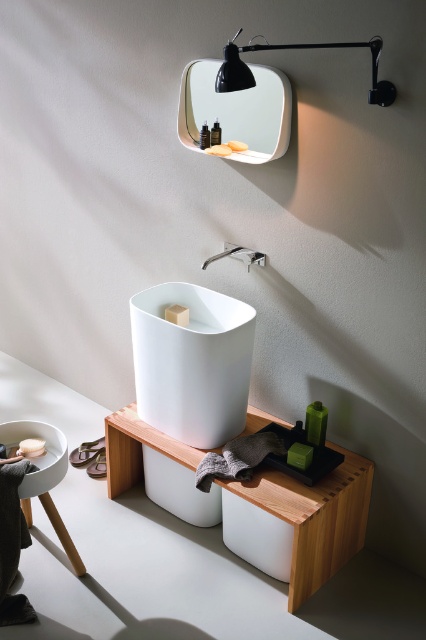
Does black matte wall lamp at upper center have a smaller size compared to matte white soap at upper center?

Incorrect, black matte wall lamp at upper center is not smaller in size than matte white soap at upper center.

Between point (239, 33) and point (227, 154), which one is positioned in front?

Point (239, 33) is more forward.

Is point (226, 60) more distant than point (224, 154)?

No, it is not.

In order to click on black matte wall lamp at upper center in this screenshot , I will do `click(296, 49)`.

Can you confirm if white matte sink at center is shorter than matte beige soap at center?

In fact, white matte sink at center may be taller than matte beige soap at center.

How far apart are white matte sink at center and matte beige soap at center?

They are 11.34 inches apart.

Does point (206, 417) lie in front of point (169, 312)?

Yes, it is in front of point (169, 312).

What are the coordinates of `white matte sink at center` in the screenshot? It's located at (192, 362).

Is white glossy mirror at upper center wider than black matte wall lamp at upper center?

In fact, white glossy mirror at upper center might be narrower than black matte wall lamp at upper center.

Consider the image. Does white glossy mirror at upper center appear on the right side of black matte wall lamp at upper center?

No, white glossy mirror at upper center is not to the right of black matte wall lamp at upper center.

Between point (218, 120) and point (388, 100), which one is positioned behind?

The point (218, 120) is behind.

At what (x,y) coordinates should I click in order to perform the action: click on white glossy mirror at upper center. Please return your answer as a coordinate pair (x, y). This screenshot has height=640, width=426. Looking at the image, I should click on (236, 109).